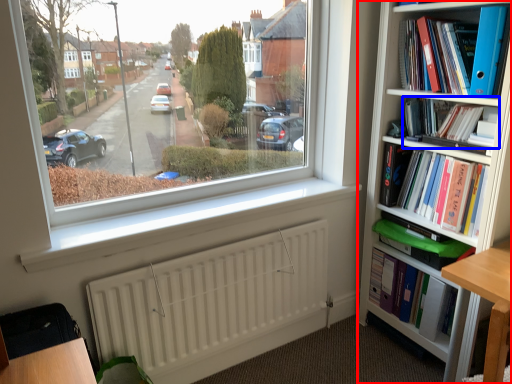
Question: Which of the following is the closest to the observer, bookcase (highlighted by a red box) or book (highlighted by a blue box)?

Choices:
 (A) bookcase
 (B) book

Answer: (A)